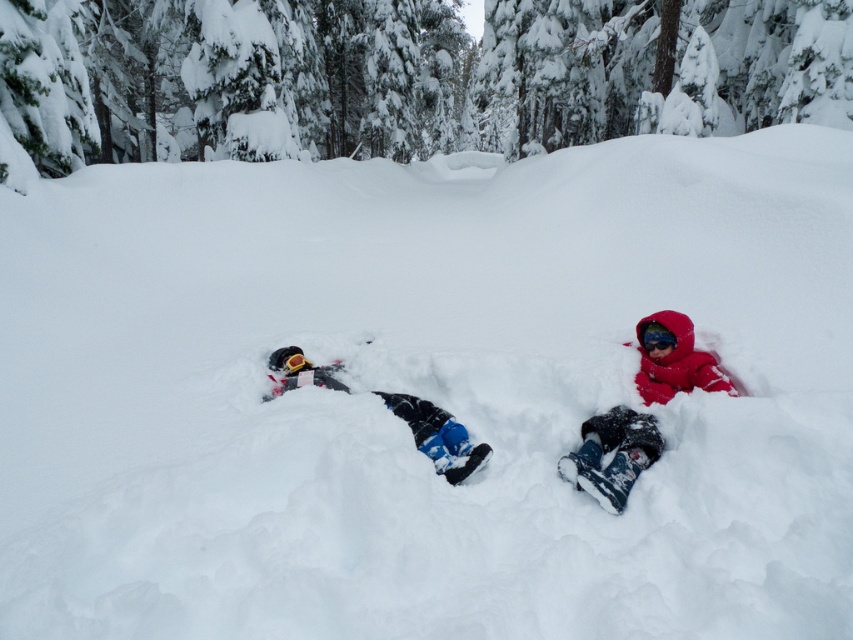
You are a parent trying to locate your child wearing the red fleece snowsuit at center in the snowy forest. Based on the coordinates provided, where exactly would you find them?

The red fleece snowsuit at center is located at coordinates point (614,454).

You are a parent trying to locate your child who is wearing a red fleece snowsuit at center. You see the matte black snow angel at center in the same area. How far apart are the two?

The red fleece snowsuit at center is 34.01 inches away from the matte black snow angel at center.

You are a photographer trying to capture the red fleece snowsuit at center and the matte black snow angel at center in a single shot. Based on their positions, which object should you focus on first to ensure both are in sharp focus?

The red fleece snowsuit at center is above the matte black snow angel at center, so focusing on the red fleece snowsuit at center first will help ensure both are in focus since it is closer to the camera.